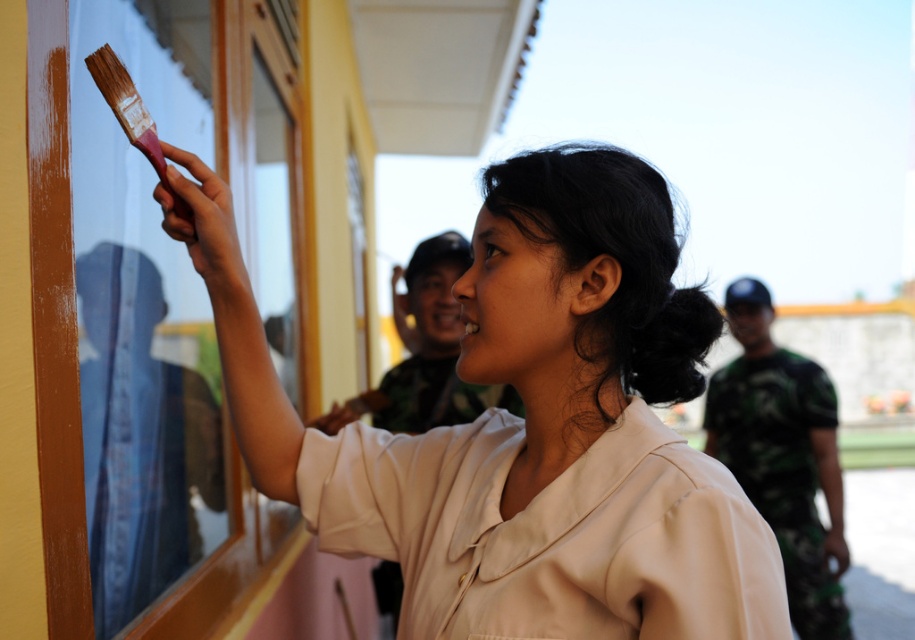
Who is more distant from viewer, (814, 477) or (416, 264)?

The point (814, 477) is behind.

Is camouflage fabric uniform at right smaller than camouflage fabric uniform at upper center?

Yes.

Does point (806, 561) come behind point (445, 417)?

Yes, it is.

Where is `camouflage fabric uniform at right`? camouflage fabric uniform at right is located at coordinates (783, 456).

Can you confirm if camouflage fabric uniform at right is smaller than pink wooden paintbrush at upper left?

No, camouflage fabric uniform at right is not smaller than pink wooden paintbrush at upper left.

Can you confirm if camouflage fabric uniform at right is positioned above pink wooden paintbrush at upper left?

No, camouflage fabric uniform at right is not above pink wooden paintbrush at upper left.

Which is in front, point (724, 419) or point (124, 72)?

Point (124, 72) is more forward.

Locate an element on the screen. camouflage fabric uniform at right is located at coordinates (783, 456).

Does matte beige shirt at upper center come behind camouflage fabric uniform at right?

No, it is not.

How much distance is there between matte beige shirt at upper center and camouflage fabric uniform at right?

2.63 meters

At what (x,y) coordinates should I click in order to perform the action: click on matte beige shirt at upper center. Please return your answer as a coordinate pair (x, y). Looking at the image, I should click on (525, 426).